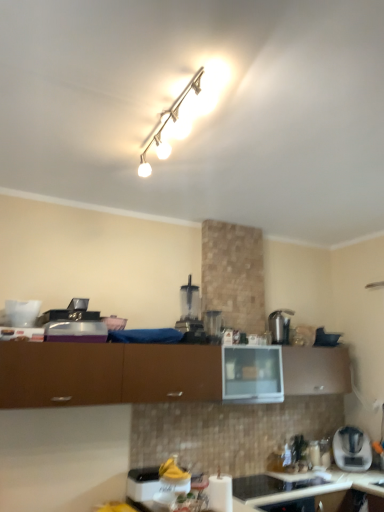
What do you see at coordinates (166, 124) in the screenshot?
I see `white glossy track light at upper center` at bounding box center [166, 124].

Where is `white glossy track light at upper center`? white glossy track light at upper center is located at coordinates click(x=166, y=124).

Measure the distance between point (225,484) and camera.

The distance of point (225,484) from camera is 8.49 feet.

The width and height of the screenshot is (384, 512). Find the location of `white glossy paper towel holder at lower center, the third appliance when ordered from back to front`. white glossy paper towel holder at lower center, the third appliance when ordered from back to front is located at coordinates (275, 484).

From the image's perspective, is white glossy track light at upper center located above white glossy countertop at lower center?

Yes, from the image's perspective, white glossy track light at upper center is above white glossy countertop at lower center.

Considering the relative positions of white glossy track light at upper center and white glossy countertop at lower center in the image provided, is white glossy track light at upper center in front of white glossy countertop at lower center?

Yes, the depth of white glossy track light at upper center is less than that of white glossy countertop at lower center.

Considering the sizes of objects white glossy track light at upper center and white glossy countertop at lower center in the image provided, who is shorter, white glossy track light at upper center or white glossy countertop at lower center?

white glossy track light at upper center.

How many degrees apart are the facing directions of brown matte cabinet at center and white glossy track light at upper center?

The angle between the facing direction of brown matte cabinet at center and the facing direction of white glossy track light at upper center is 6.31 degrees.

Can you confirm if brown matte cabinet at center is shorter than white glossy track light at upper center?

In fact, brown matte cabinet at center may be taller than white glossy track light at upper center.

Is brown matte cabinet at center wider or thinner than white glossy track light at upper center?

Considering their sizes, brown matte cabinet at center looks broader than white glossy track light at upper center.

Considering their positions, is brown matte cabinet at center located in front of or behind white glossy track light at upper center?

brown matte cabinet at center is behind white glossy track light at upper center.

Relative to white plastic toaster at lower right, is brown matte cabinet at center in front or behind?

brown matte cabinet at center is positioned closer to the viewer than white plastic toaster at lower right.

From the image's perspective, does brown matte cabinet at center appear higher than white plastic toaster at lower right?

Correct, brown matte cabinet at center appears higher than white plastic toaster at lower right in the image.

From a real-world perspective, is brown matte cabinet at center physically located above or below white plastic toaster at lower right?

Clearly, from a real-world perspective, brown matte cabinet at center is above white plastic toaster at lower right.

In the image, is white glossy countertop at lower center positioned in front of or behind brown matte cabinet at center?

white glossy countertop at lower center is behind brown matte cabinet at center.

Is white glossy countertop at lower center to the left of brown matte cabinet at center from the viewer's perspective?

No.

From the image's perspective, who appears lower, white glossy countertop at lower center or brown matte cabinet at center?

white glossy countertop at lower center is shown below in the image.

From the image's perspective, relative to white paper towel holder at lower center, the second appliance from the bottom, is white glossy track light at upper center above or below?

Clearly, from the image's perspective, white glossy track light at upper center is above white paper towel holder at lower center, the second appliance from the bottom.

Based on the photo, is white glossy track light at upper center oriented away from white paper towel holder at lower center, the second appliance from the bottom?

No, white glossy track light at upper center's orientation is not away from white paper towel holder at lower center, the second appliance from the bottom.

Considering their positions, is white glossy track light at upper center located in front of or behind white paper towel holder at lower center, which is the fourth appliance in back-to-front order?

white glossy track light at upper center is in front of white paper towel holder at lower center, which is the fourth appliance in back-to-front order.

Consider the image. From their relative heights in the image, would you say white glossy track light at upper center is taller or shorter than white paper towel holder at lower center, the second appliance from the bottom?

Clearly, white glossy track light at upper center is shorter compared to white paper towel holder at lower center, the second appliance from the bottom.

Can you confirm if clear plastic blender at center, positioned as the fourth appliance in bottom-to-top order, is thinner than white glossy countertop at lower center?

Yes.

Image resolution: width=384 pixels, height=512 pixels. What are the coordinates of `the 4th appliance above the white glossy countertop at lower center (from the image's perspective)` in the screenshot? It's located at (213, 325).

From the picture: Can you confirm if clear plastic blender at center, acting as the first appliance starting from the top, is shorter than white glossy countertop at lower center?

Yes, clear plastic blender at center, acting as the first appliance starting from the top, is shorter than white glossy countertop at lower center.

Between clear plastic blender at center, positioned as the fourth appliance in bottom-to-top order, and white glossy countertop at lower center, which one appears on the right side from the viewer's perspective?

From the viewer's perspective, white glossy countertop at lower center appears more on the right side.

Can we say white plastic toaster at lower right lies outside white glossy track light at upper center?

Yes, white plastic toaster at lower right is not within white glossy track light at upper center.

Which is more to the right, white plastic toaster at lower right or white glossy track light at upper center?

white plastic toaster at lower right.

Between white plastic toaster at lower right and white glossy track light at upper center, which one has larger width?

white plastic toaster at lower right.

How many degrees apart are the facing directions of white plastic toaster at lower right and white glossy track light at upper center?

white plastic toaster at lower right and white glossy track light at upper center are facing 125 degrees away from each other.

What are the coordinates of `countertop that is on the right side of white glossy track light at upper center` in the screenshot? It's located at (43, 481).

Locate an element on the screen. This screenshot has height=512, width=384. lamp above the brown matte cabinet at center (from a real-world perspective) is located at coordinates (166, 124).

Considering their positions, is white glossy track light at upper center positioned further to brown matte cabinet at center than white glossy paper towel holder at lower center, the 4th appliance when ordered from top to bottom?

→ Among the two, white glossy track light at upper center is located further to brown matte cabinet at center.

Based on their spatial positions, is satin silver kettle at upper right, which is the third appliance in bottom-to-top order, or white glossy paper towel holder at lower center, the third appliance when ordered from back to front, closer to brown matte cabinet at center?

white glossy paper towel holder at lower center, the third appliance when ordered from back to front, is positioned closer to the anchor brown matte cabinet at center.

From the image, which object appears to be nearer to satin silver kettle at upper right, which is the fourth appliance in front-to-back order, white glossy track light at upper center or white glossy paper towel holder at lower center, which ranks as the first appliance in bottom-to-top order?

white glossy paper towel holder at lower center, which ranks as the first appliance in bottom-to-top order, is closer to satin silver kettle at upper right, which is the fourth appliance in front-to-back order.

Estimate the real-world distances between objects in this image. Which object is closer to white paper towel holder at lower center, which is the 3th appliance from top to bottom, satin silver kettle at upper right, which is the fourth appliance in front-to-back order, or white glossy paper towel holder at lower center, the third appliance when ordered from back to front?

Answer: white glossy paper towel holder at lower center, the third appliance when ordered from back to front.

From the image, which object appears to be nearer to clear plastic blender at center, positioned as the fourth appliance in bottom-to-top order, brown matte cabinet at center or white glossy countertop at lower center?

brown matte cabinet at center lies closer to clear plastic blender at center, positioned as the fourth appliance in bottom-to-top order, than the other object.

Estimate the real-world distances between objects in this image. Which object is further from satin silver kettle at upper right, which is the 2th appliance in top-to-bottom order, transparent plastic blender at center or white paper towel holder at lower center, positioned as the 1th appliance in front-to-back order?

Based on the image, white paper towel holder at lower center, positioned as the 1th appliance in front-to-back order, appears to be further to satin silver kettle at upper right, which is the 2th appliance in top-to-bottom order.

From the image, which object appears to be nearer to white glossy paper towel holder at lower center, the 4th appliance when ordered from top to bottom, white plastic toaster at lower right or brown matte cabinet at center?

The object closer to white glossy paper towel holder at lower center, the 4th appliance when ordered from top to bottom, is white plastic toaster at lower right.

Considering their positions, is white glossy paper towel holder at lower center, the third appliance when ordered from back to front, positioned further to white plastic toaster at lower right than transparent plastic blender at center?

Among the two, transparent plastic blender at center is located further to white plastic toaster at lower right.

Image resolution: width=384 pixels, height=512 pixels. Identify the location of kitchen appliance between white glossy track light at upper center and white glossy paper towel holder at lower center, the 4th appliance when ordered from top to bottom, in the vertical direction. 352,455.

Find the location of a particular element. coffee machine between brown matte cabinet at center and clear plastic blender at center, positioned as the 3th appliance in front-to-back order, along the z-axis is located at coordinates (189, 309).

Where is `coffee machine that lies between white glossy track light at upper center and white glossy countertop at lower center from top to bottom`? coffee machine that lies between white glossy track light at upper center and white glossy countertop at lower center from top to bottom is located at coordinates (189, 309).

Identify the location of coffee machine located between white glossy track light at upper center and satin silver kettle at upper right, which is the third appliance in bottom-to-top order, in the depth direction. (189, 309).